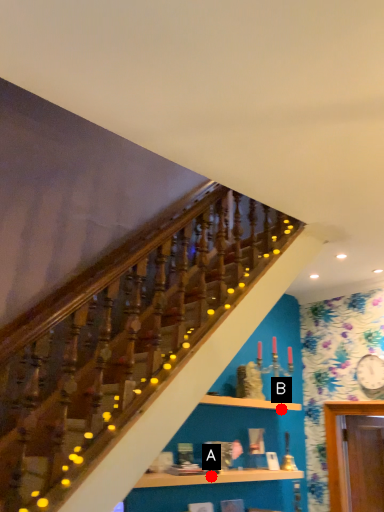
Question: Two points are circled on the image, labeled by A and B beside each circle. Which point is farther from the camera taking this photo?

Choices:
 (A) A is further
 (B) B is further

Answer: (B)